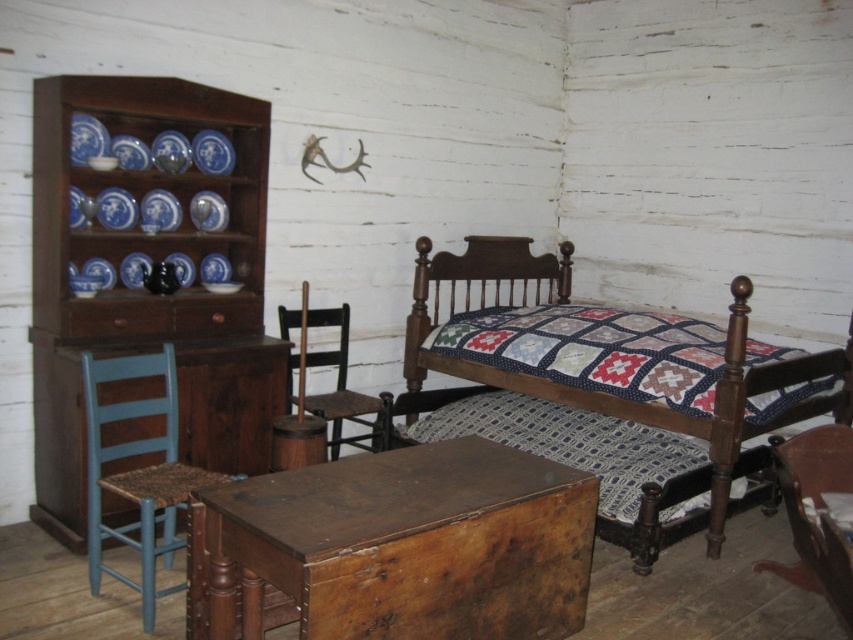
Question: Does quilted fabric at center appear on the left side of blue woven wood chair at left?

Choices:
 (A) yes
 (B) no

Answer: (B)

Question: Which is farther from the quilted fabric bed at center?

Choices:
 (A) quilted fabric at center
 (B) rustic brown wooden table at center

Answer: (B)

Question: Observing the image, what is the correct spatial positioning of rustic brown wooden table at center in reference to blue woven wood chair at left?

Choices:
 (A) above
 (B) below

Answer: (B)

Question: Estimate the real-world distances between objects in this image. Which object is closer to the blue woven wood chair at left?

Choices:
 (A) wooden chair at center
 (B) wooden quilted bed at center
 (C) brown wood drawer at left
 (D) rustic brown wooden table at center

Answer: (C)

Question: Is wooden chair at center to the right of brown wood drawer at left from the viewer's perspective?

Choices:
 (A) no
 (B) yes

Answer: (B)

Question: Which is nearer to the dark brown wood dresser at left?

Choices:
 (A) blue woven wood chair at left
 (B) quilted fabric bed at center
 (C) wooden chair at center

Answer: (A)